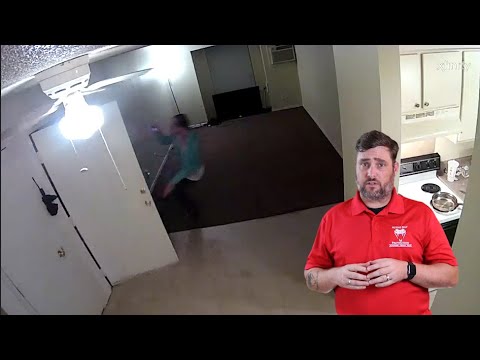
The width and height of the screenshot is (480, 360). I want to click on cabinets, so click(x=423, y=103).